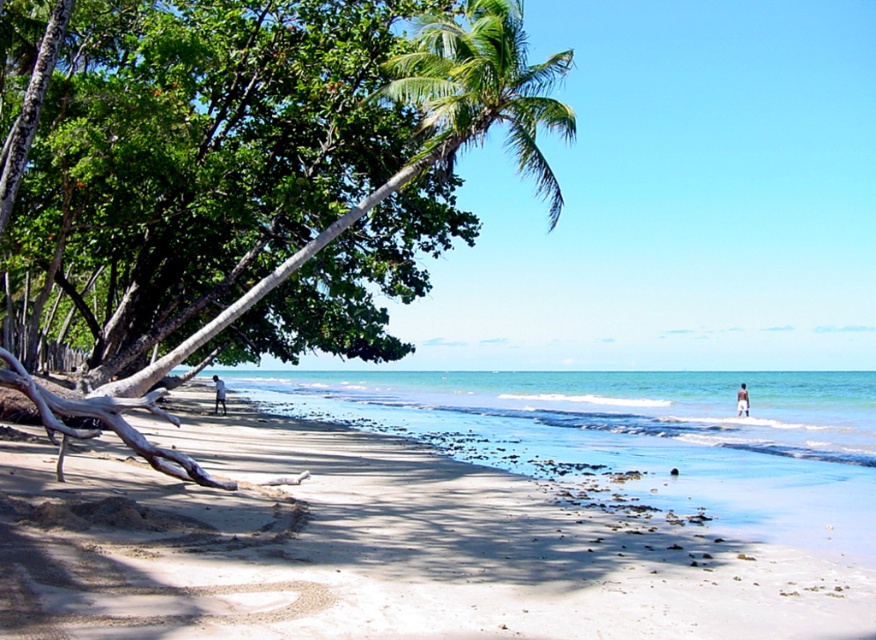
You are a photographer trying to capture the white sandy beach at center and the light brown skin at beach right in a single shot. Which object should you focus on first if you want to ensure both are in the frame without moving the camera?

The white sandy beach at center has a greater height compared to the light brown skin at beach right, so focusing on the taller object first will ensure both are in the frame.

You are a photographer aiming to capture a photo of the light brown skin at beach right without the green leafy palm tree at upper center blocking the view. Can you position yourself in a way that the palm tree is not in front of the light brown skin?

The green leafy palm tree at upper center is larger than the light brown skin at beach right, so positioning yourself to avoid the palm tree blocking the view may be challenging due to its size. However, by moving to the right side of the scene, you might be able to frame the shot so the palm tree is not directly in front of the light brown skin.